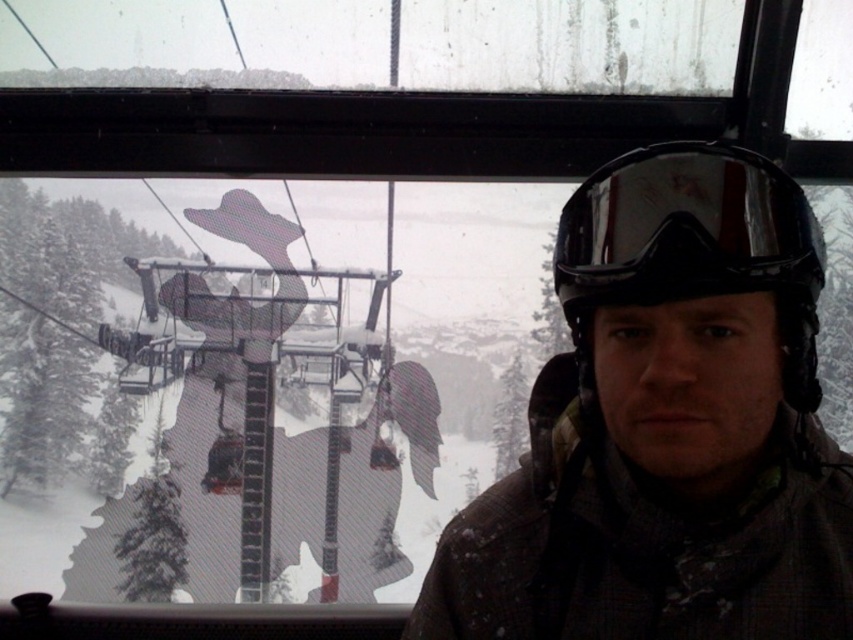
You are standing at the point marked as point [666,428] in the ski lift cabin. What object is located exactly at this point?

The camouflage jacket at center is located exactly at point [666,428].

You are a photographer trying to capture a clear photo of the black reflective goggles at center and the camouflage jacket at center through the frosty window. Since the window is frosted, you need to decide which object to focus on first based on their sizes. Which object should you focus on first to ensure better clarity?

The camouflage jacket at center is larger than the black reflective goggles at center, so focusing on the camouflage jacket at center first would provide better clarity due to its larger size making it easier to capture clearly through the frosted window.